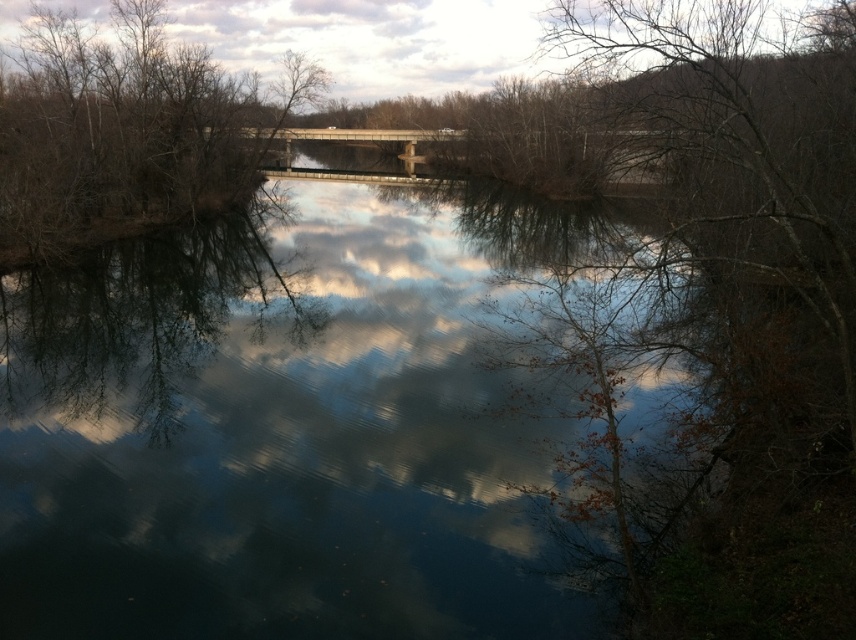
Looking at this image, can you confirm if transparent water at center is wider than brown/dry wood tree at upper center?

Yes.

Is the position of transparent water at center less distant than that of brown/dry wood tree at upper center?

Yes, transparent water at center is closer to the viewer.

The width and height of the screenshot is (856, 640). Find the location of `transparent water at center`. transparent water at center is located at coordinates (278, 435).

I want to click on brown/dry wood tree at upper center, so click(x=123, y=129).

Can you confirm if brown/dry wood tree at upper center is taller than concrete bridge at center?

Yes.

Which is behind, point (113, 97) or point (424, 131)?

The point (424, 131) is more distant.

Find the location of `brown/dry wood tree at upper center`. brown/dry wood tree at upper center is located at coordinates (123, 129).

Who is more forward, (102, 305) or (385, 140)?

Point (102, 305)

Does transparent water at center appear on the left side of concrete bridge at center?

Incorrect, transparent water at center is not on the left side of concrete bridge at center.

Describe the element at coordinates (278, 435) in the screenshot. This screenshot has width=856, height=640. I see `transparent water at center` at that location.

Identify the location of transparent water at center. (278, 435).